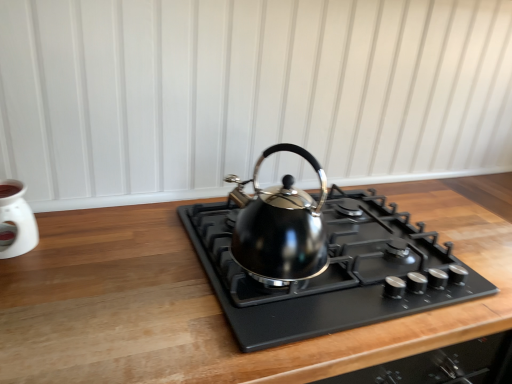
Question: Does black metallic kettle at center have a larger size compared to white glossy oil burner at left?

Choices:
 (A) no
 (B) yes

Answer: (B)

Question: Is black metallic kettle at center outside white glossy oil burner at left?

Choices:
 (A) no
 (B) yes

Answer: (B)

Question: Does black metallic kettle at center have a smaller size compared to white glossy oil burner at left?

Choices:
 (A) yes
 (B) no

Answer: (B)

Question: Does black metallic kettle at center have a greater height compared to white glossy oil burner at left?

Choices:
 (A) no
 (B) yes

Answer: (B)

Question: Is black metallic kettle at center at the left side of white glossy oil burner at left?

Choices:
 (A) no
 (B) yes

Answer: (A)

Question: From a real-world perspective, is black matte gas stove at center physically located above or below white glossy oil burner at left?

Choices:
 (A) above
 (B) below

Answer: (B)

Question: Considering the positions of black matte gas stove at center and white glossy oil burner at left in the image, is black matte gas stove at center taller or shorter than white glossy oil burner at left?

Choices:
 (A) short
 (B) tall

Answer: (A)

Question: Based on their sizes in the image, would you say black matte gas stove at center is bigger or smaller than white glossy oil burner at left?

Choices:
 (A) small
 (B) big

Answer: (B)

Question: In the image, is black matte gas stove at center positioned in front of or behind white glossy oil burner at left?

Choices:
 (A) front
 (B) behind

Answer: (A)

Question: Is white glossy oil burner at left spatially inside black matte gas stove at center, or outside of it?

Choices:
 (A) outside
 (B) inside

Answer: (A)

Question: Is white glossy oil burner at left in front of or behind black matte gas stove at center in the image?

Choices:
 (A) behind
 (B) front

Answer: (A)

Question: In terms of height, does white glossy oil burner at left look taller or shorter compared to black matte gas stove at center?

Choices:
 (A) tall
 (B) short

Answer: (A)

Question: Is white glossy oil burner at left bigger or smaller than black matte gas stove at center?

Choices:
 (A) small
 (B) big

Answer: (A)

Question: From their relative heights in the image, would you say black metallic kettle at center is taller or shorter than white glossy oil burner at left?

Choices:
 (A) tall
 (B) short

Answer: (A)

Question: Looking at their shapes, would you say black metallic kettle at center is wider or thinner than white glossy oil burner at left?

Choices:
 (A) wide
 (B) thin

Answer: (A)